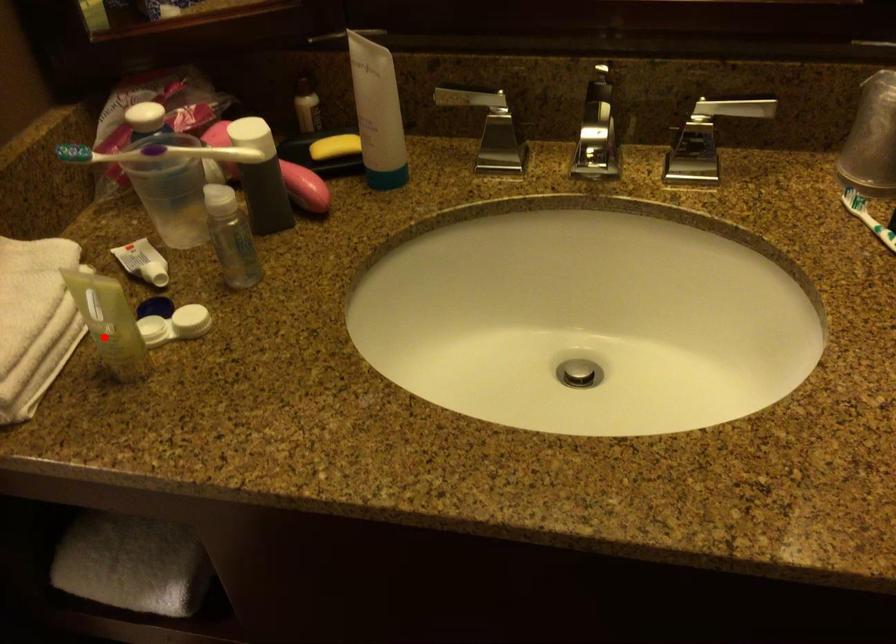
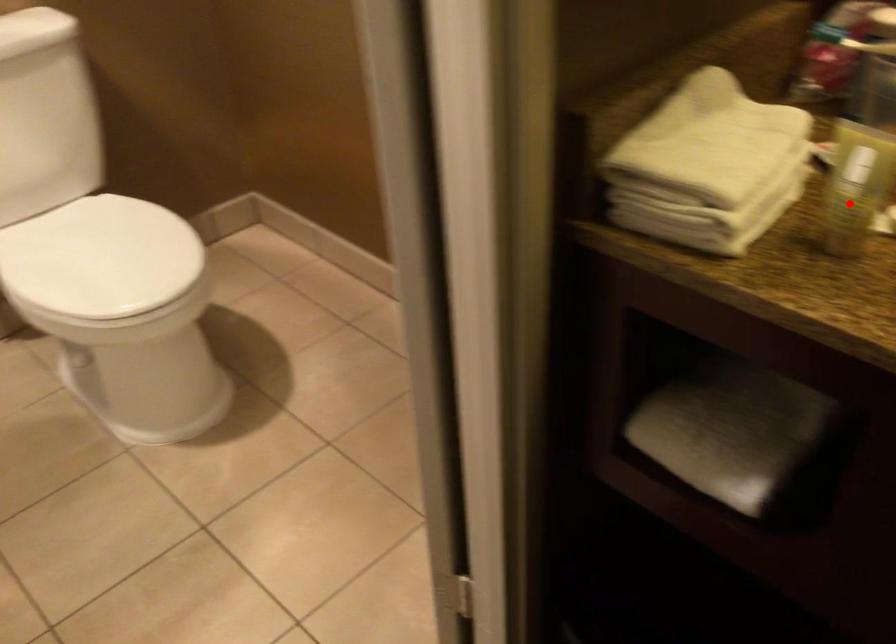
I am providing you with two images of the same scene from different viewpoints. A red point is marked on the first image and another point is marked on the second image. Do the highlighted points in image1 and image2 indicate the same real-world spot?

Yes